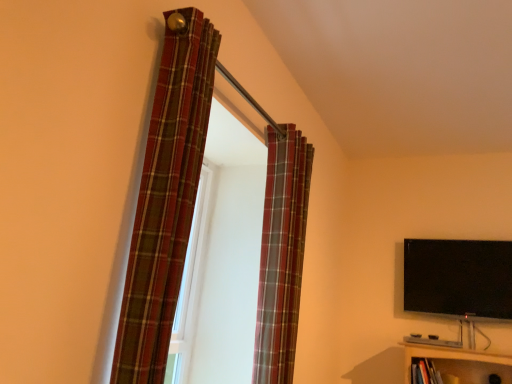
The image size is (512, 384). I want to click on plaid fabric curtain at left, the 1th curtain in the front-to-back sequence, so click(166, 198).

In order to click on plaid fabric curtain at left, positioned as the second curtain in back-to-front order in this screenshot , I will do click(x=166, y=198).

Is black glossy flat-screen tv at upper right with plaid fabric curtain at left, placed as the 2th curtain when sorted from right to left?

black glossy flat-screen tv at upper right is not next to plaid fabric curtain at left, placed as the 2th curtain when sorted from right to left, and they're not touching.

Which object is positioned more to the right, black glossy flat-screen tv at upper right or plaid fabric curtain at left, marked as the first curtain in a left-to-right arrangement?

black glossy flat-screen tv at upper right.

From the picture: Which of these two, black glossy flat-screen tv at upper right or plaid fabric curtain at left, the 1th curtain in the front-to-back sequence, stands taller?

plaid fabric curtain at left, the 1th curtain in the front-to-back sequence, is taller.

From the image's perspective, does black glossy flat-screen tv at upper right appear higher than plaid fabric curtain at upper center, the first curtain viewed from the back?

No, from the image's perspective, black glossy flat-screen tv at upper right is not on top of plaid fabric curtain at upper center, the first curtain viewed from the back.

Which object is positioned more to the right, black glossy flat-screen tv at upper right or plaid fabric curtain at upper center, the first curtain viewed from the back?

Positioned to the right is black glossy flat-screen tv at upper right.

Which is farther, (479, 300) or (300, 134)?

The point (479, 300) is farther.

From the image's perspective, is plaid fabric curtain at left, positioned as the second curtain in back-to-front order, under black glossy flat-screen tv at upper right?

No.

How much distance is there between plaid fabric curtain at left, placed as the 2th curtain when sorted from right to left, and black glossy flat-screen tv at upper right?

The distance of plaid fabric curtain at left, placed as the 2th curtain when sorted from right to left, from black glossy flat-screen tv at upper right is 8.19 feet.

Is plaid fabric curtain at left, the 1th curtain in the front-to-back sequence, aimed at black glossy flat-screen tv at upper right?

No, plaid fabric curtain at left, the 1th curtain in the front-to-back sequence, does not turn towards black glossy flat-screen tv at upper right.

Does plaid fabric curtain at left, positioned as the second curtain in back-to-front order, touch black glossy flat-screen tv at upper right?

No, plaid fabric curtain at left, positioned as the second curtain in back-to-front order, is not making contact with black glossy flat-screen tv at upper right.

In the scene shown: From a real-world perspective, is plaid fabric curtain at upper center, the 2th curtain viewed from the front, below plaid fabric curtain at left, placed as the 2th curtain when sorted from right to left?

Indeed, from a real-world perspective, plaid fabric curtain at upper center, the 2th curtain viewed from the front, is positioned beneath plaid fabric curtain at left, placed as the 2th curtain when sorted from right to left.

What's the angular difference between plaid fabric curtain at upper center, the first curtain viewed from the back, and plaid fabric curtain at left, placed as the 2th curtain when sorted from right to left,'s facing directions?

The facing directions of plaid fabric curtain at upper center, the first curtain viewed from the back, and plaid fabric curtain at left, placed as the 2th curtain when sorted from right to left, are 0.00139 degrees apart.

Is point (263, 214) behind point (147, 189)?

Yes.

Is plaid fabric curtain at upper center, the 2th curtain viewed from the front, aimed at black glossy flat-screen tv at upper right?

No, plaid fabric curtain at upper center, the 2th curtain viewed from the front, is not facing towards black glossy flat-screen tv at upper right.

In the scene shown: From a real-world perspective, is plaid fabric curtain at upper center, the 1th curtain in the right-to-left sequence, below black glossy flat-screen tv at upper right?

Indeed, from a real-world perspective, plaid fabric curtain at upper center, the 1th curtain in the right-to-left sequence, is positioned beneath black glossy flat-screen tv at upper right.

Between plaid fabric curtain at left, the 1th curtain in the front-to-back sequence, and plaid fabric curtain at upper center, the first curtain viewed from the back, which one has less height?

Standing shorter between the two is plaid fabric curtain at left, the 1th curtain in the front-to-back sequence.

From the image's perspective, is plaid fabric curtain at left, positioned as the second curtain in back-to-front order, above or below plaid fabric curtain at upper center, which is the second curtain from left to right?

Based on their image positions, plaid fabric curtain at left, positioned as the second curtain in back-to-front order, is located above plaid fabric curtain at upper center, which is the second curtain from left to right.

Which object is positioned more to the left, plaid fabric curtain at left, placed as the 2th curtain when sorted from right to left, or plaid fabric curtain at upper center, the 2th curtain viewed from the front?

plaid fabric curtain at left, placed as the 2th curtain when sorted from right to left.

This screenshot has width=512, height=384. I want to click on the 2nd curtain to the left of the black glossy flat-screen tv at upper right, counting from the anchor's position, so click(x=166, y=198).

Find the location of a particular element. television above the plaid fabric curtain at upper center, the 1th curtain in the right-to-left sequence (from a real-world perspective) is located at coordinates [458, 278].

When comparing their distances from plaid fabric curtain at left, marked as the first curtain in a left-to-right arrangement, does plaid fabric curtain at upper center, which is the second curtain from left to right, or black glossy flat-screen tv at upper right seem closer?

The object closer to plaid fabric curtain at left, marked as the first curtain in a left-to-right arrangement, is plaid fabric curtain at upper center, which is the second curtain from left to right.

When comparing their distances from black glossy flat-screen tv at upper right, does plaid fabric curtain at upper center, which is the second curtain from left to right, or plaid fabric curtain at left, placed as the 2th curtain when sorted from right to left, seem further?

Among the two, plaid fabric curtain at left, placed as the 2th curtain when sorted from right to left, is located further to black glossy flat-screen tv at upper right.

Which object lies further to the anchor point plaid fabric curtain at upper center, the 1th curtain in the right-to-left sequence, black glossy flat-screen tv at upper right or plaid fabric curtain at left, placed as the 2th curtain when sorted from right to left?

black glossy flat-screen tv at upper right.

Based on their spatial positions, is plaid fabric curtain at left, positioned as the second curtain in back-to-front order, or black glossy flat-screen tv at upper right closer to plaid fabric curtain at upper center, the 1th curtain in the right-to-left sequence?

plaid fabric curtain at left, positioned as the second curtain in back-to-front order, lies closer to plaid fabric curtain at upper center, the 1th curtain in the right-to-left sequence, than the other object.

Looking at the image, which one is located closer to plaid fabric curtain at left, placed as the 2th curtain when sorted from right to left, black glossy flat-screen tv at upper right or plaid fabric curtain at upper center, which is the second curtain from left to right?

plaid fabric curtain at upper center, which is the second curtain from left to right, is positioned closer to the anchor plaid fabric curtain at left, placed as the 2th curtain when sorted from right to left.

From the image, which object appears to be farther from black glossy flat-screen tv at upper right, plaid fabric curtain at left, marked as the first curtain in a left-to-right arrangement, or plaid fabric curtain at upper center, the first curtain viewed from the back?

plaid fabric curtain at left, marked as the first curtain in a left-to-right arrangement, is positioned further to the anchor black glossy flat-screen tv at upper right.

Find the location of a particular element. Image resolution: width=512 pixels, height=384 pixels. curtain between plaid fabric curtain at left, placed as the 2th curtain when sorted from right to left, and black glossy flat-screen tv at upper right in the front-back direction is located at coordinates (281, 255).